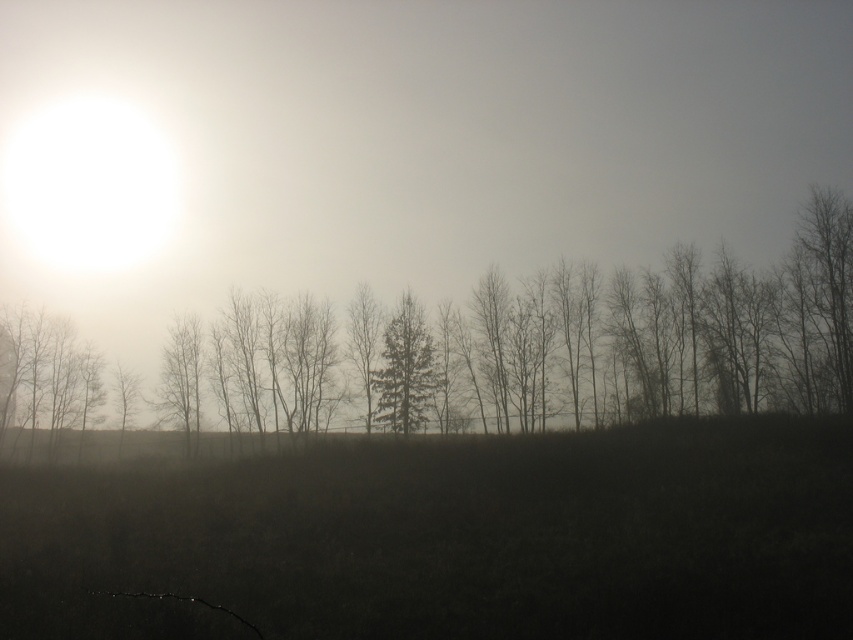
You are an explorer in the misty landscape. You need to cross the dark grass at center and reach the green matte tree at center. Which path should you take to avoid getting lost in the mist?

The dark grass at center is wider than the green matte tree at center, so you should aim to stay closer to the tree to minimize the distance you need to traverse through the mist.

You are standing in the misty landscape and want to walk towards the sun in the upper left corner. Which direction should you move relative to the dark grass at center?

The dark grass at center is located at point (451, 538). Since the sun is in the upper left corner, you should move towards the upper left direction away from the dark grass at center.

You are an observer standing in the dark grass at center. You want to walk towards the silhouette bare tree at center. Which direction should you walk to avoid the bright sunlight coming from the upper left corner?

The silhouette bare tree at center is behind the dark grass at center, so you should walk towards the direction away from the upper left sunlight to reach the tree. Walking towards the opposite direction of the sunlight would be better to avoid the bright light while moving towards the tree.